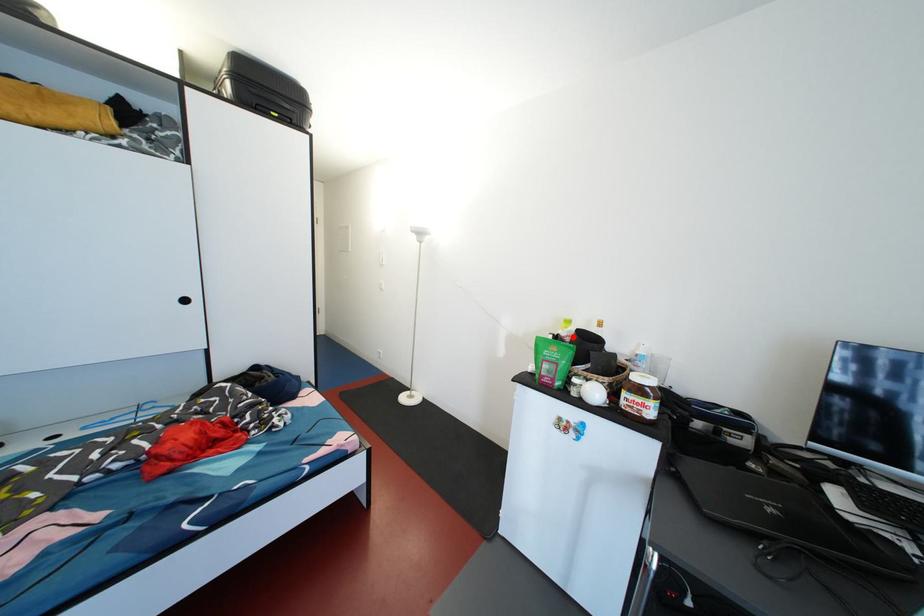
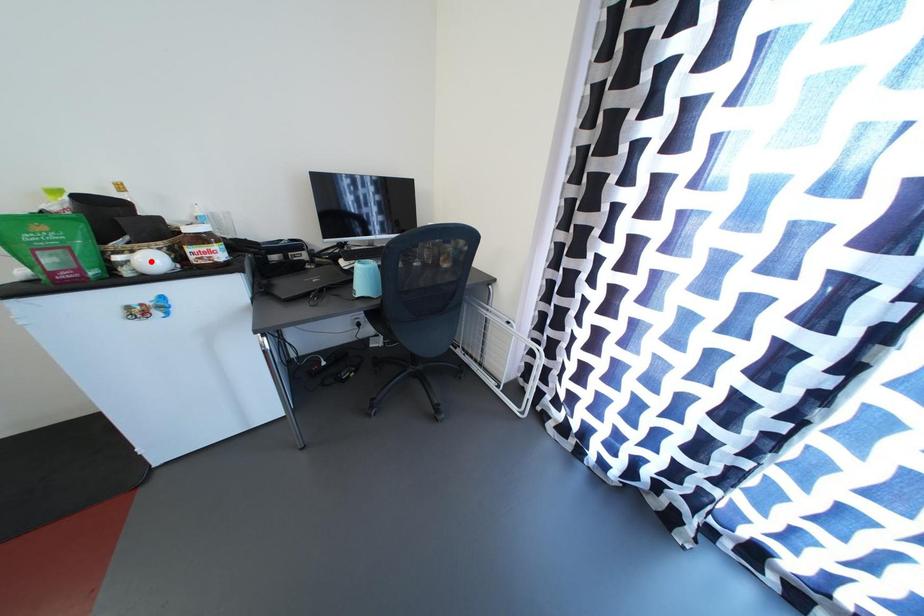
I am providing you with two images of the same scene from different viewpoints. A red point is marked on the first image and another point is marked on the second image. Is the marked point in image1 the same physical position as the marked point in image2?

No